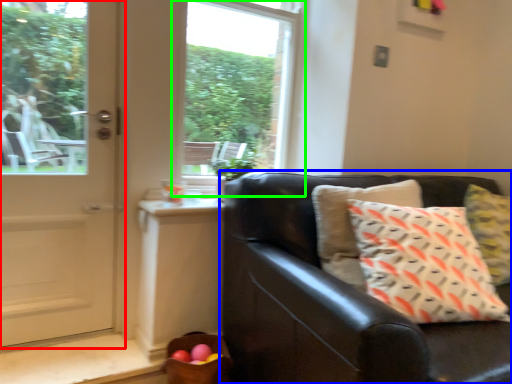
Question: Which is nearer to the door (highlighted by a red box)? studio couch (highlighted by a blue box) or window (highlighted by a green box).

Choices:
 (A) studio couch
 (B) window

Answer: (B)